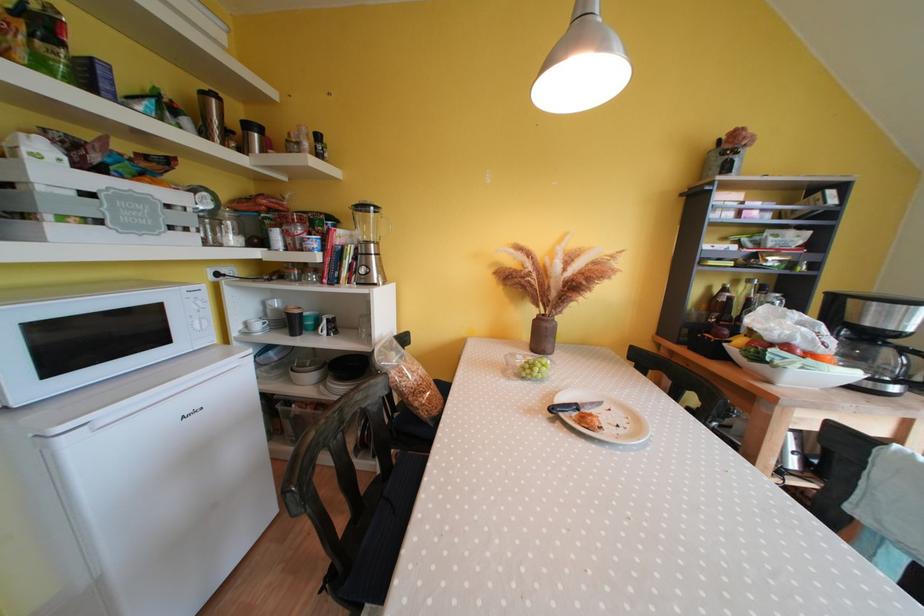
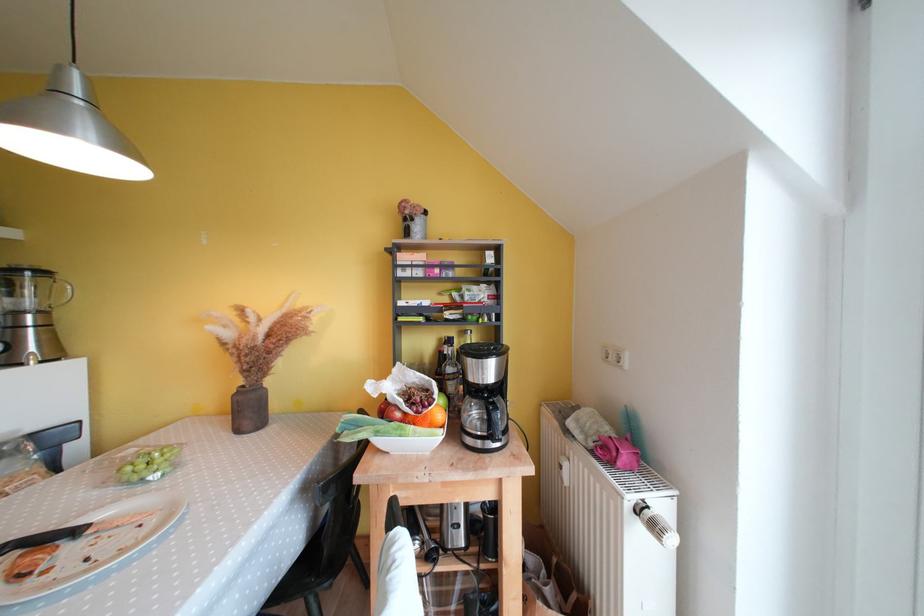
In the second image, find the point that corresponds to (383,246) in the first image.

(49, 315)